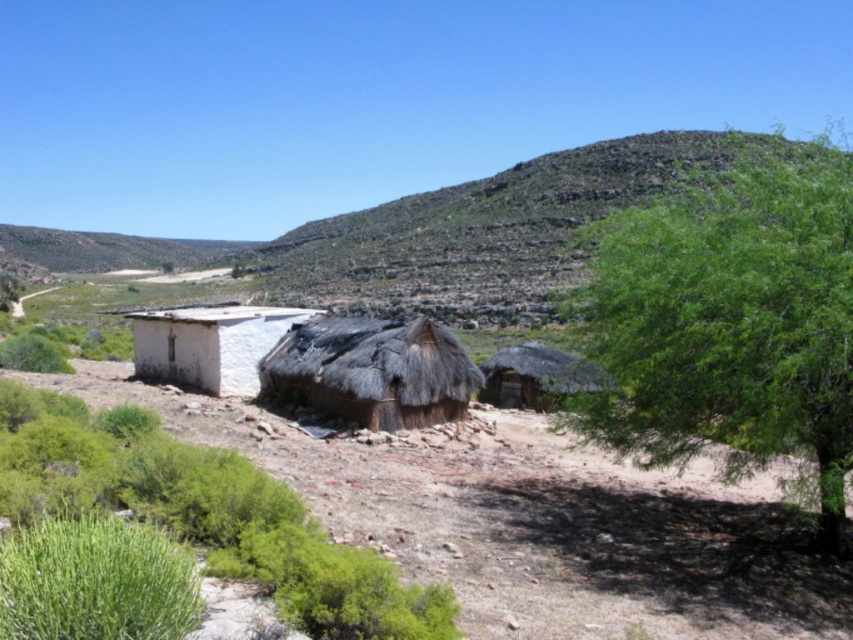
You are a traveler in this rural landscape and want to locate the white thatch hut at left. According to the coordinates provided, where should you look to find it?

The white thath hut at left is located at coordinates point (x=209, y=344).

You are standing in the middle of the dry landscape and see the green leafy tree at right and the brown thatch hut at center. Which object is closer to you?

The green leafy tree at right is closer because it is in front of the brown thatch hut at center, indicating it is nearer to your position.

You are planning to set up a tent in this rural area. Considering the green leafy tree at right and the brown thatch hut at center, which one is taller and would provide more shade?

The green leafy tree at right is much taller than the brown thatch hut at center, so it would provide more shade.